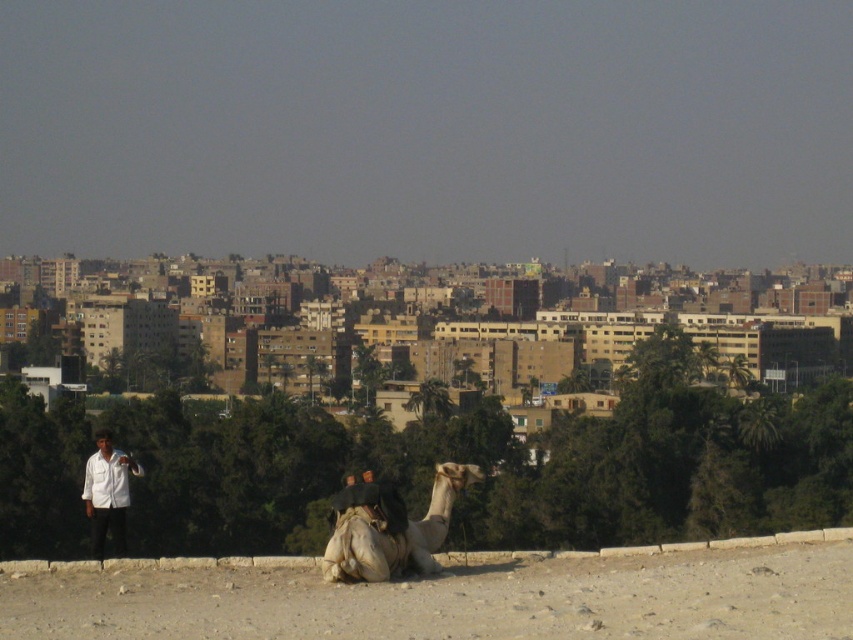
Question: Among these points, which one is nearest to the camera?

Choices:
 (A) (91, 468)
 (B) (405, 541)

Answer: (B)

Question: Can you confirm if beige sand camel at lower center is bigger than light beige textured camel at center?

Choices:
 (A) no
 (B) yes

Answer: (B)

Question: Considering the real-world distances, which object is closest to the white matte shirt at left?

Choices:
 (A) light beige textured camel at center
 (B) beige sand camel at lower center

Answer: (A)

Question: Does beige sand camel at lower center have a smaller size compared to white matte shirt at left?

Choices:
 (A) no
 (B) yes

Answer: (B)

Question: Can you confirm if light beige textured camel at center is smaller than white matte shirt at left?

Choices:
 (A) no
 (B) yes

Answer: (B)

Question: Which object is the farthest from the white matte shirt at left?

Choices:
 (A) light beige textured camel at center
 (B) beige sand camel at lower center

Answer: (B)